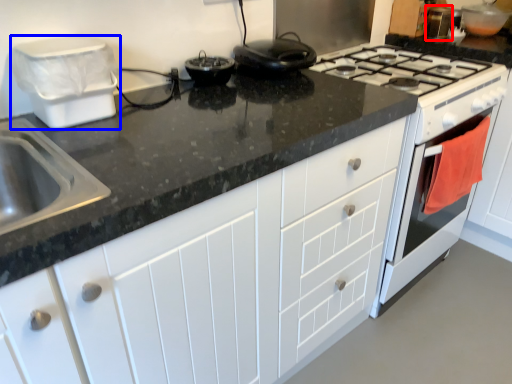
Question: Which point is further to the camera, appliance (highlighted by a red box) or appliance (highlighted by a blue box)?

Choices:
 (A) appliance
 (B) appliance

Answer: (A)